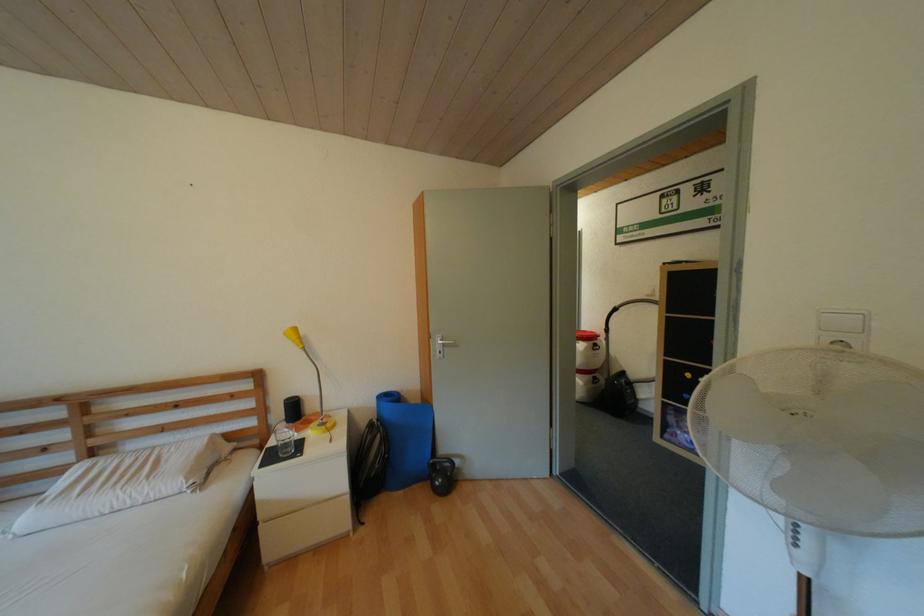
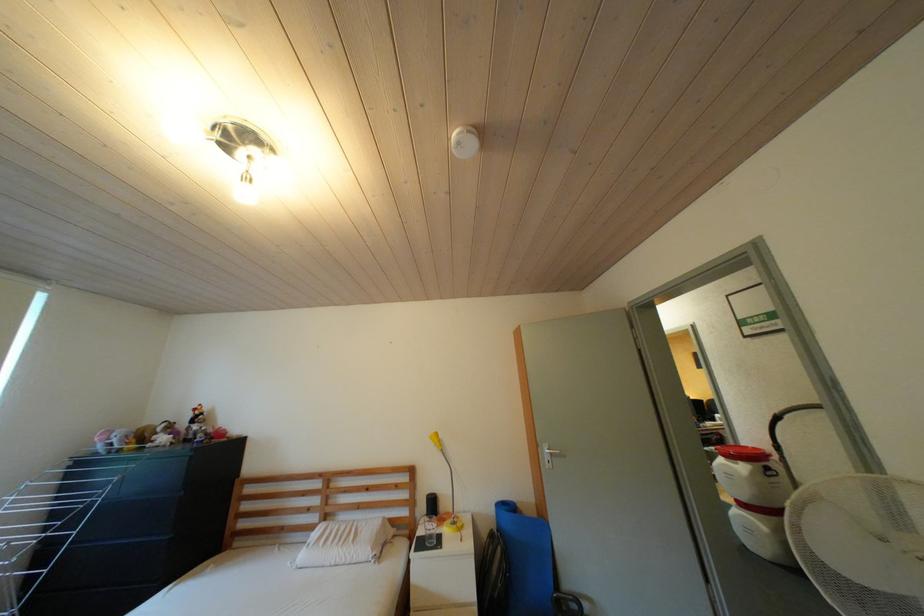
Locate, in the second image, the point that corresponds to [599,339] in the first image.

(763, 458)